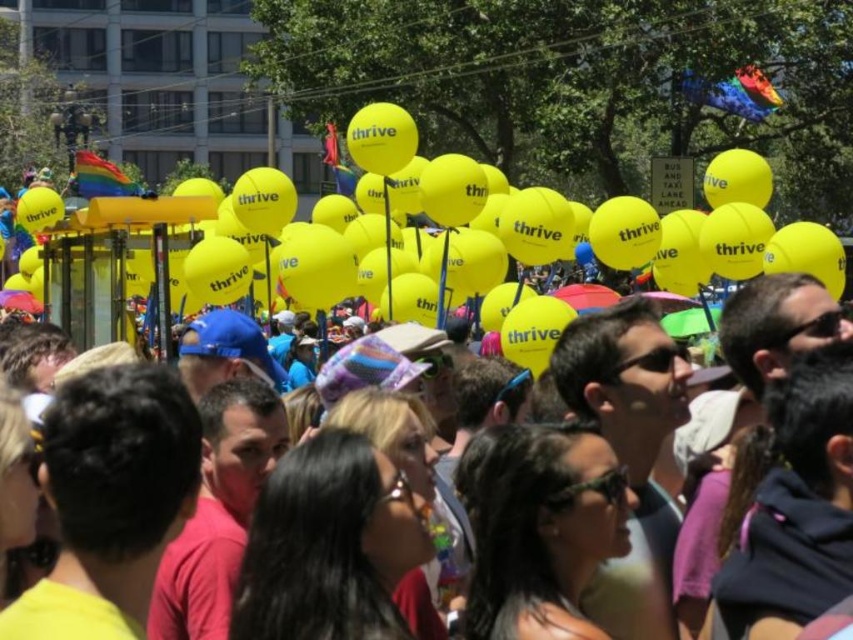
Question: Which object is closer to the camera taking this photo?

Choices:
 (A) yellow matte balloons at upper center
 (B) yellow matte balloon at upper center

Answer: (A)

Question: Observing the image, what is the correct spatial positioning of yellow matte balloon at upper center in reference to yellow matte balloons at upper center?

Choices:
 (A) below
 (B) above

Answer: (B)

Question: Can you confirm if yellow matte balloon at upper center is wider than yellow matte balloons at upper center?

Choices:
 (A) no
 (B) yes

Answer: (B)

Question: Can you confirm if yellow matte balloon at upper center is bigger than yellow matte balloons at upper center?

Choices:
 (A) no
 (B) yes

Answer: (B)